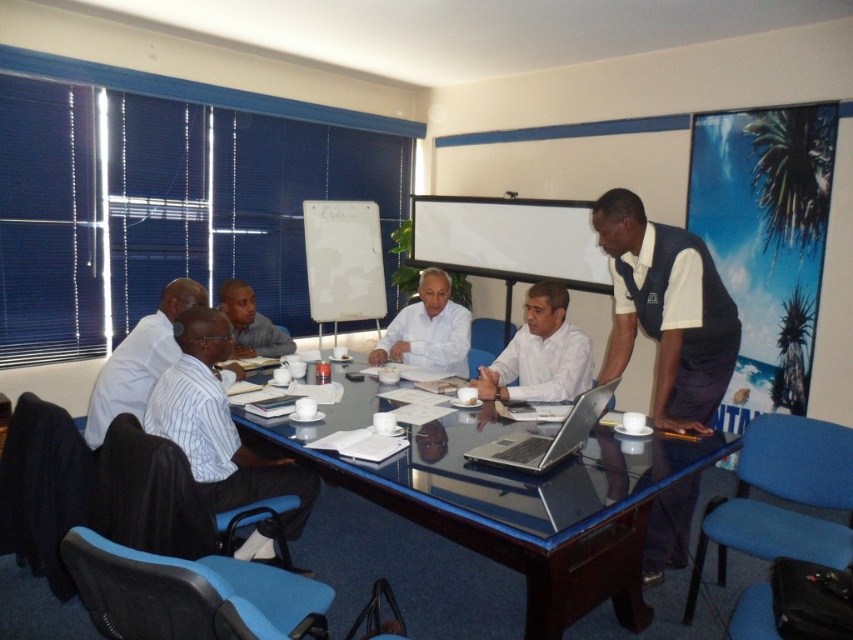
Question: Does white shirt at left have a larger size compared to white matte shirt at center?

Choices:
 (A) yes
 (B) no

Answer: (A)

Question: Is white striped shirt at lower left to the right of white shirt at center from the viewer's perspective?

Choices:
 (A) no
 (B) yes

Answer: (A)

Question: Estimate the real-world distances between objects in this image. Which object is closer to the silver metallic laptop at center?

Choices:
 (A) white matte shirt at center
 (B) white shirt at center
 (C) white shirt at left
 (D) white striped shirt at lower left

Answer: (B)

Question: Which point is farther from the camera taking this photo?

Choices:
 (A) (556, 356)
 (B) (445, 314)
 (C) (531, 467)

Answer: (B)

Question: Can you confirm if white shirt at left is positioned above white matte shirt at center?

Choices:
 (A) no
 (B) yes

Answer: (A)

Question: Which point is closer to the camera taking this photo?

Choices:
 (A) (589, 529)
 (B) (717, 374)

Answer: (A)